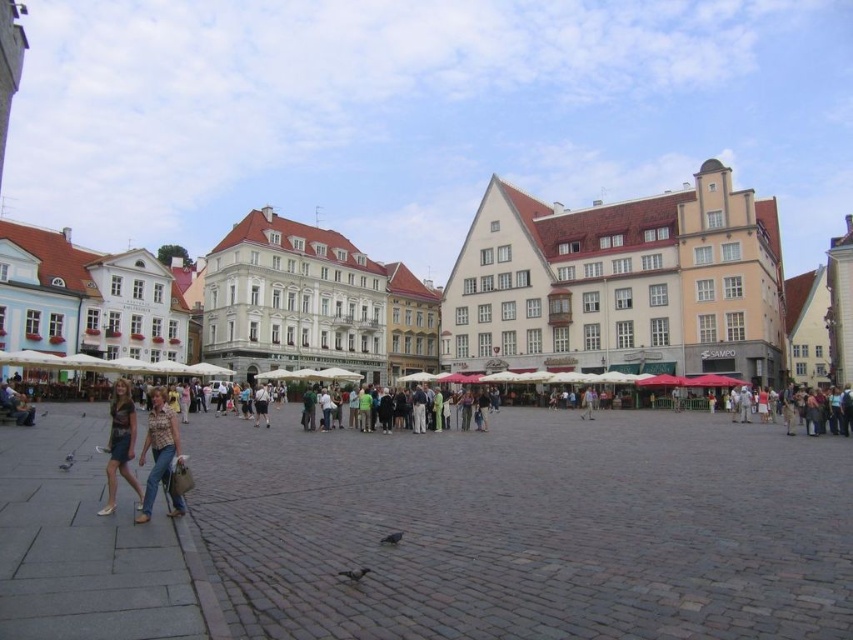
This screenshot has height=640, width=853. Describe the element at coordinates (440, 294) in the screenshot. I see `white textured building at center` at that location.

From the picture: Measure the distance between point (624, 353) and camera.

Point (624, 353) is 78.84 meters away from camera.

Is point (656, 253) positioned in front of point (108, 449)?

No, (656, 253) is further to viewer.

The image size is (853, 640). I want to click on white textured building at center, so click(440, 294).

Does white textured building at center have a greater height compared to denim jeans at lower left?

Yes.

The width and height of the screenshot is (853, 640). What do you see at coordinates (440, 294) in the screenshot? I see `white textured building at center` at bounding box center [440, 294].

I want to click on white textured building at center, so click(x=440, y=294).

Does denim jeans at lower left have a larger size compared to denim skirt at lower left?

Actually, denim jeans at lower left might be smaller than denim skirt at lower left.

Which is more to the right, denim jeans at lower left or denim skirt at lower left?

denim jeans at lower left is more to the right.

Is point (157, 412) behind point (128, 388)?

No, it is not.

At what (x,y) coordinates should I click in order to perform the action: click on denim jeans at lower left. Please return your answer as a coordinate pair (x, y). Looking at the image, I should click on (160, 456).